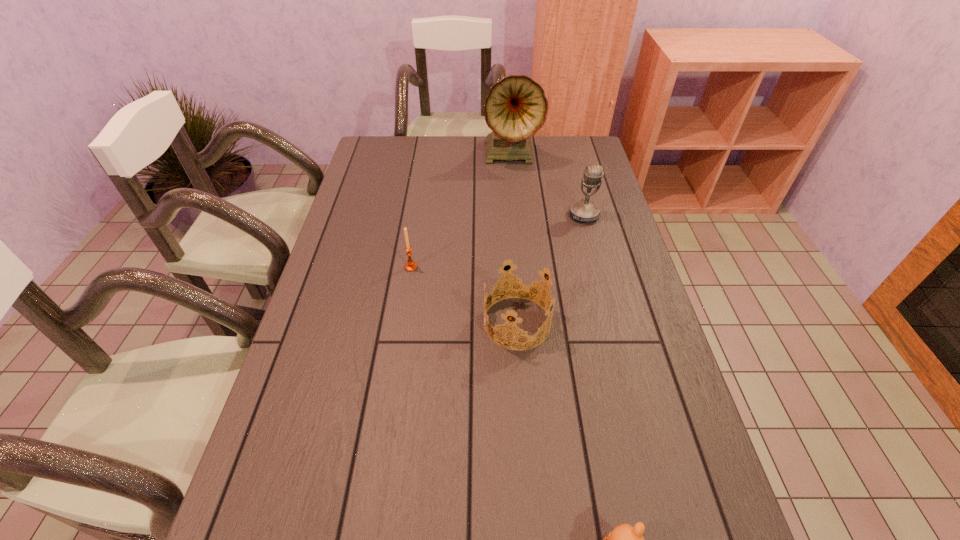
Where is `free space that is in between the tallest object and the second nearest object`? This screenshot has width=960, height=540. free space that is in between the tallest object and the second nearest object is located at coordinates (514, 239).

The height and width of the screenshot is (540, 960). Identify the location of blank region between the leftmost object and the farthest object. (461, 211).

I want to click on free space that is in between the record player and the leftmost object, so click(x=461, y=211).

You are a GUI agent. You are given a task and a screenshot of the screen. Output one action in this format:
    pyautogui.click(x=<x>, y=<y>)
    Task: Click on the empty space between the second nearest object and the record player
    The width and height of the screenshot is (960, 540).
    Given the screenshot: What is the action you would take?
    pyautogui.click(x=514, y=239)

Locate which object ranks third in proximity to the microphone. Please provide its 2D coordinates. Your answer should be formatted as a tuple, i.e. [(x, y)], where the tuple contains the x and y coordinates of a point satisfying the conditions above.

[(411, 266)]

What are the coordinates of `object identified as the third closest to the candle_holder` in the screenshot? It's located at (515, 108).

Locate an element on the screen. The width and height of the screenshot is (960, 540). vacant region that satisfies the following two spatial constraints: 1. on the front side of the second nearest object; 2. on the right side of the third nearest object is located at coordinates (402, 323).

You are a GUI agent. You are given a task and a screenshot of the screen. Output one action in this format:
    pyautogui.click(x=<x>, y=<y>)
    Task: Click on the vacant region that satisfies the following two spatial constraints: 1. on the front side of the crown; 2. on the left side of the leftmost object
    
    Given the screenshot: What is the action you would take?
    [402, 323]